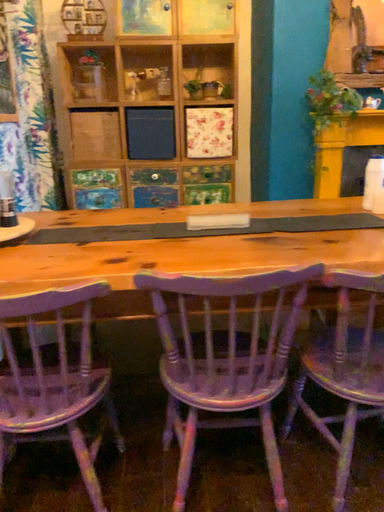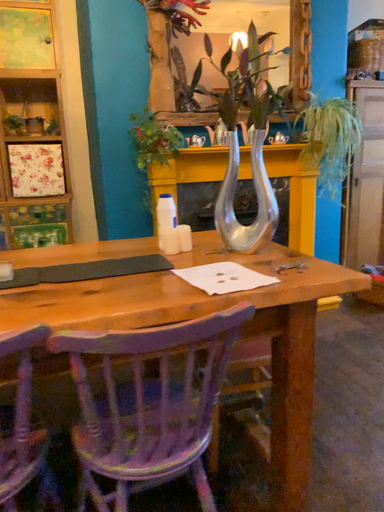
Question: How did the camera likely rotate when shooting the video?

Choices:
 (A) rotated right
 (B) rotated left

Answer: (A)